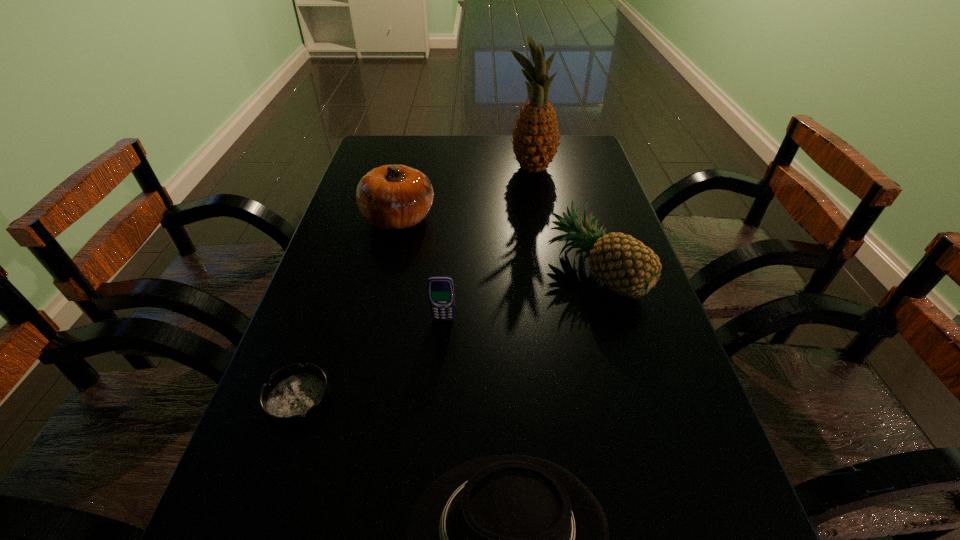
Locate an element on the screen. This screenshot has width=960, height=540. the tallest object is located at coordinates (535, 138).

Find the location of a particular element. This screenshot has height=540, width=960. the farther pineapple is located at coordinates (535, 138).

Identify the location of pumpkin. This screenshot has height=540, width=960. (390, 197).

What are the coordinates of `the nearer pineapple` in the screenshot? It's located at (623, 263).

At what (x,y) coordinates should I click in order to perform the action: click on the fourth farthest object. Please return your answer as a coordinate pair (x, y). The image size is (960, 540). Looking at the image, I should click on click(x=440, y=288).

Where is `ashtray`? This screenshot has height=540, width=960. ashtray is located at coordinates (295, 395).

I want to click on the shortest object, so click(x=295, y=395).

This screenshot has height=540, width=960. I want to click on blank space located on the front of the taller pineapple, so click(538, 203).

In order to click on blank space located 0.310m on the front of the pumpkin in this screenshot , I will do `click(372, 337)`.

The height and width of the screenshot is (540, 960). I want to click on vacant space located on the front of the shorter pineapple, so (x=621, y=369).